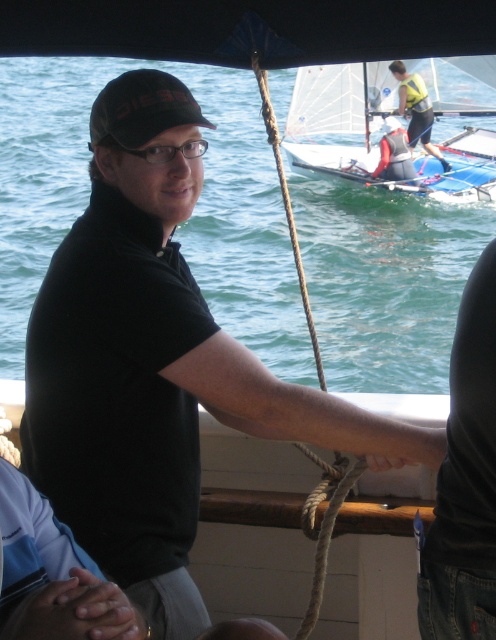
Question: Which is nearer to the roperoughrope at center?

Choices:
 (A) brown leather hand at lower left
 (B) smooth skin hand at center

Answer: (B)

Question: Is the position of black matte baseball cap at upper left less distant than that of clear plastic glasses at center?

Choices:
 (A) yes
 (B) no

Answer: (A)

Question: Is white sailboat at upper center smaller than brown leather hand at lower left?

Choices:
 (A) no
 (B) yes

Answer: (A)

Question: Which of the following is the closest to the observer?

Choices:
 (A) (174, 76)
 (B) (423, 163)
 (C) (148, 152)
 (D) (363, 465)

Answer: (C)

Question: Considering the real-world distances, which object is farthest from the roperoughrope at center?

Choices:
 (A) clear plastic glasses at center
 (B) brown leather hand at lower left
 (C) smooth skin hand at center
 (D) yellow life vest at upper right

Answer: (D)

Question: In this image, where is brown leather hand at lower left located relative to clear plastic glasses at center?

Choices:
 (A) above
 (B) below

Answer: (B)